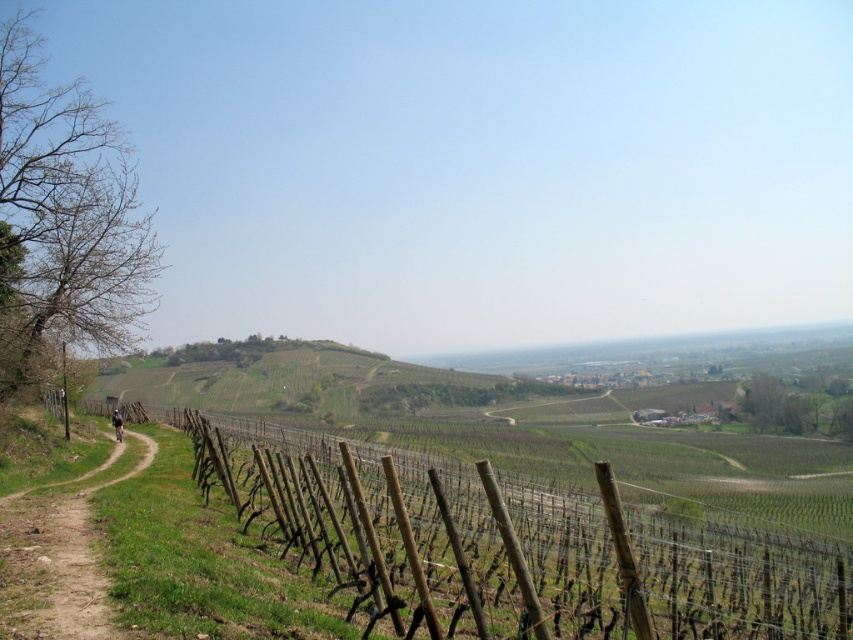
Is brown wooden fence at center positioned at the back of brown dirt path at left?

No.

Who is shorter, brown wooden fence at center or brown dirt path at left?

Standing shorter between the two is brown dirt path at left.

Locate an element on the screen. This screenshot has width=853, height=640. brown wooden fence at center is located at coordinates (514, 550).